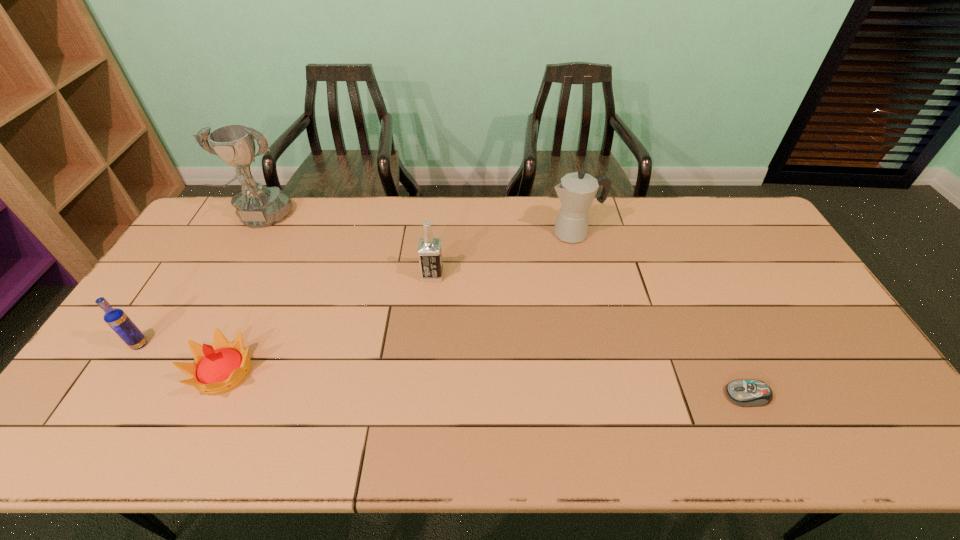
The image size is (960, 540). In order to click on award in this screenshot , I will do `click(257, 206)`.

Image resolution: width=960 pixels, height=540 pixels. I want to click on the fifth shortest object, so click(x=577, y=190).

You are a GUI agent. You are given a task and a screenshot of the screen. Output one action in this format:
    pyautogui.click(x=<x>, y=<y>)
    Task: Click on the coffeepot
    
    Given the screenshot: What is the action you would take?
    pyautogui.click(x=577, y=190)

Where is `the farther vodka`? This screenshot has width=960, height=540. the farther vodka is located at coordinates (429, 252).

In order to click on the third farthest object in this screenshot , I will do `click(429, 252)`.

The width and height of the screenshot is (960, 540). Find the location of `the leftmost object`. the leftmost object is located at coordinates (120, 323).

Locate an element on the screen. the left vodka is located at coordinates (120, 323).

I want to click on the second shortest object, so click(217, 369).

I want to click on the shortest object, so click(x=748, y=393).

Identify the location of computer mouse. This screenshot has width=960, height=540. (748, 393).